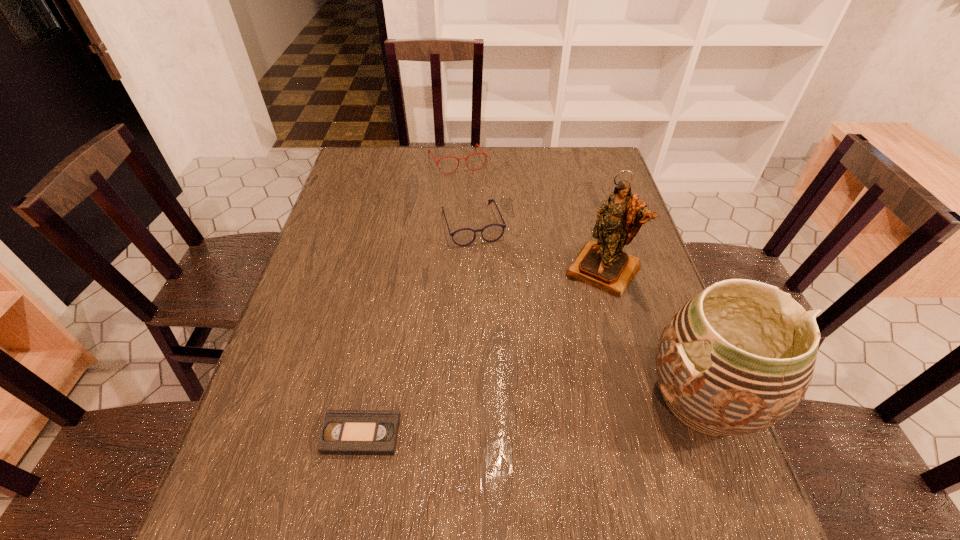
Locate an element on the screen. The image size is (960, 540). vacant region between the nearer spectacles and the figurine is located at coordinates [x=538, y=247].

Where is `vacant space in between the pottery and the videotape`? The image size is (960, 540). vacant space in between the pottery and the videotape is located at coordinates (531, 416).

I want to click on vacant point located between the figurine and the farther spectacles, so click(x=530, y=215).

Locate an element on the screen. free area in between the figurine and the nearer spectacles is located at coordinates (538, 247).

What are the coordinates of `blank region between the nearer spectacles and the videotape` in the screenshot? It's located at (417, 329).

The image size is (960, 540). I want to click on vacant area between the videotape and the pottery, so click(531, 416).

This screenshot has width=960, height=540. Identify the location of free space between the farther spectacles and the figurine. (530, 215).

Identify the location of free spot between the nearer spectacles and the farthest object. (465, 193).

Where is `object that is the fourth closest to the figurine`? The width and height of the screenshot is (960, 540). object that is the fourth closest to the figurine is located at coordinates click(x=344, y=432).

Choose which object is the third nearest neighbor to the figurine. Please provide its 2D coordinates. Your answer should be formatted as a tuple, i.e. [(x, y)], where the tuple contains the x and y coordinates of a point satisfying the conditions above.

[(429, 151)]